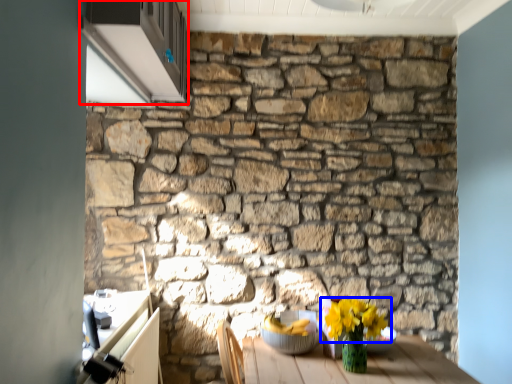
Question: Which object appears closest to the camera in this image, window (highlighted by a red box) or flower (highlighted by a blue box)?

Choices:
 (A) window
 (B) flower

Answer: (A)